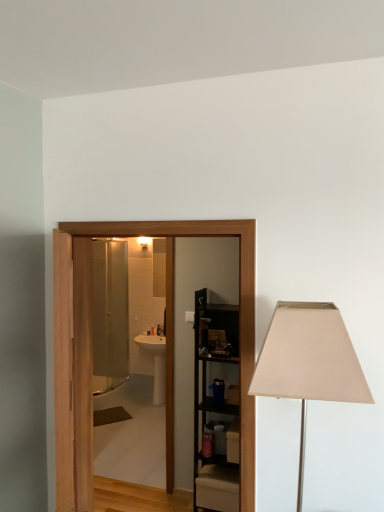
Question: Is the depth of black metal shelving unit at center less than that of wooden door at center?

Choices:
 (A) yes
 (B) no

Answer: (B)

Question: Considering the relative positions of black metal shelving unit at center and wooden door at center in the image provided, is black metal shelving unit at center to the right of wooden door at center from the viewer's perspective?

Choices:
 (A) no
 (B) yes

Answer: (B)

Question: Is black metal shelving unit at center thinner than wooden door at center?

Choices:
 (A) yes
 (B) no

Answer: (B)

Question: Is black metal shelving unit at center wider than wooden door at center?

Choices:
 (A) no
 (B) yes

Answer: (B)

Question: Is the depth of black metal shelving unit at center greater than that of wooden door at center?

Choices:
 (A) yes
 (B) no

Answer: (A)

Question: From the image's perspective, is beige fabric lampshade at right located above or below black metal shelving unit at center?

Choices:
 (A) above
 (B) below

Answer: (A)

Question: Considering the positions of point tap(283, 352) and point tap(218, 360), is point tap(283, 352) closer or farther from the camera than point tap(218, 360)?

Choices:
 (A) farther
 (B) closer

Answer: (B)

Question: From a real-world perspective, is beige fabric lampshade at right physically located above or below black metal shelving unit at center?

Choices:
 (A) above
 (B) below

Answer: (A)

Question: Based on their positions, is beige fabric lampshade at right located to the left or right of black metal shelving unit at center?

Choices:
 (A) left
 (B) right

Answer: (B)

Question: Which is correct: black metal shelving unit at center is inside beige fabric lampshade at right, or outside of it?

Choices:
 (A) outside
 (B) inside

Answer: (A)

Question: Considering the positions of black metal shelving unit at center and beige fabric lampshade at right in the image, is black metal shelving unit at center bigger or smaller than beige fabric lampshade at right?

Choices:
 (A) small
 (B) big

Answer: (B)

Question: Considering the positions of black metal shelving unit at center and beige fabric lampshade at right in the image, is black metal shelving unit at center wider or thinner than beige fabric lampshade at right?

Choices:
 (A) wide
 (B) thin

Answer: (B)

Question: From a real-world perspective, relative to beige fabric lampshade at right, is black metal shelving unit at center vertically above or below?

Choices:
 (A) above
 (B) below

Answer: (B)

Question: From the image's perspective, is wooden door at center positioned above or below black metal shelving unit at center?

Choices:
 (A) above
 (B) below

Answer: (A)

Question: Based on their positions, is wooden door at center located to the left or right of black metal shelving unit at center?

Choices:
 (A) left
 (B) right

Answer: (A)